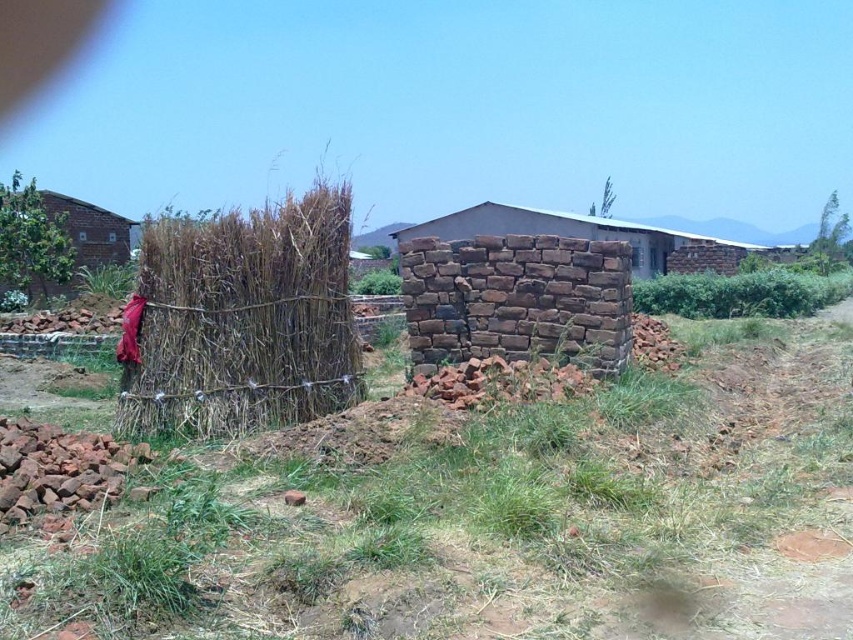
Describe the element at coordinates (492, 516) in the screenshot. Image resolution: width=853 pixels, height=640 pixels. I see `green grass at center` at that location.

Does green grass at center appear on the right side of brown stone wall at center?

In fact, green grass at center is to the left of brown stone wall at center.

Is point (344, 621) positioned behind point (450, 234)?

No.

What are the coordinates of `green grass at center` in the screenshot? It's located at (492, 516).

Who is lower down, brown stone wall at center or brick wall at left?

brick wall at left

Which is in front, point (635, 275) or point (126, 225)?

Positioned in front is point (126, 225).

The height and width of the screenshot is (640, 853). What do you see at coordinates (572, 234) in the screenshot?
I see `brown stone wall at center` at bounding box center [572, 234].

Identify the location of brown stone wall at center. This screenshot has height=640, width=853. (572, 234).

Can you confirm if green grass at center is wider than brick wall at left?

Indeed, green grass at center has a greater width compared to brick wall at left.

This screenshot has height=640, width=853. Describe the element at coordinates (492, 516) in the screenshot. I see `green grass at center` at that location.

Where is `green grass at center`? green grass at center is located at coordinates (492, 516).